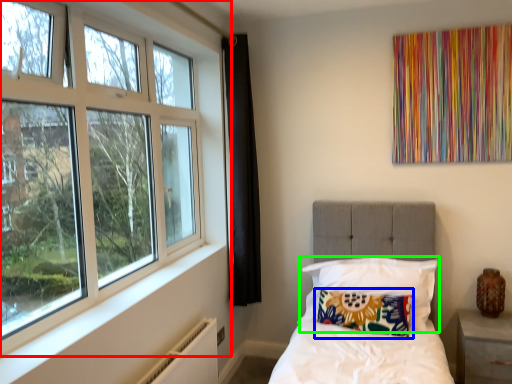
Question: Which is nearer to the window (highlighted by a red box)? pillow (highlighted by a blue box) or pillow (highlighted by a green box).

Choices:
 (A) pillow
 (B) pillow

Answer: (B)